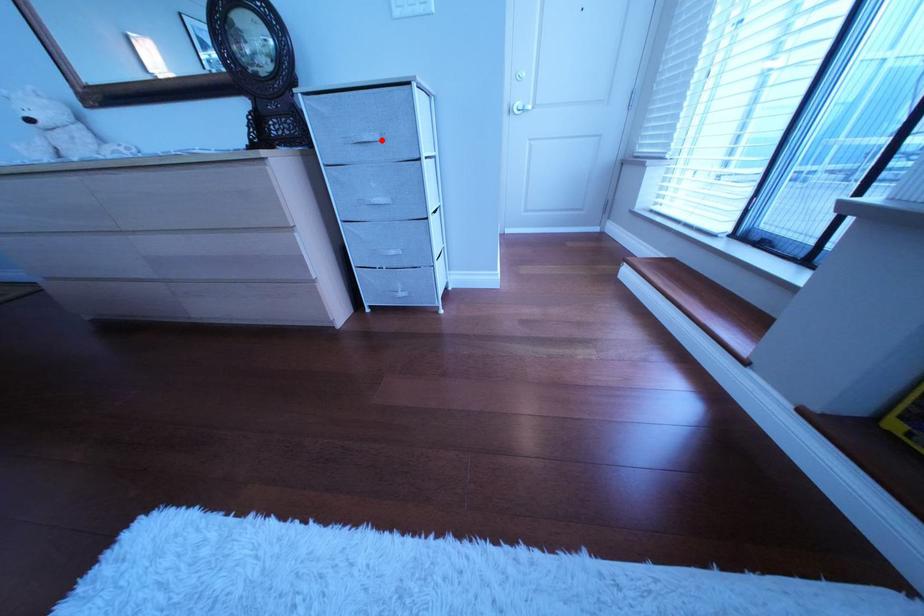
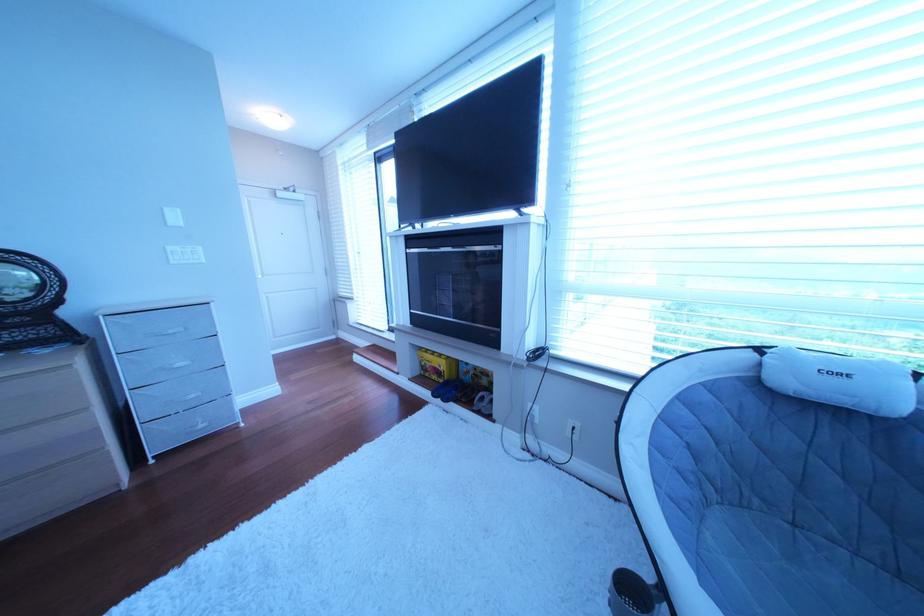
Find the pixel in the second image that matches the highlighted location in the first image.

(188, 334)